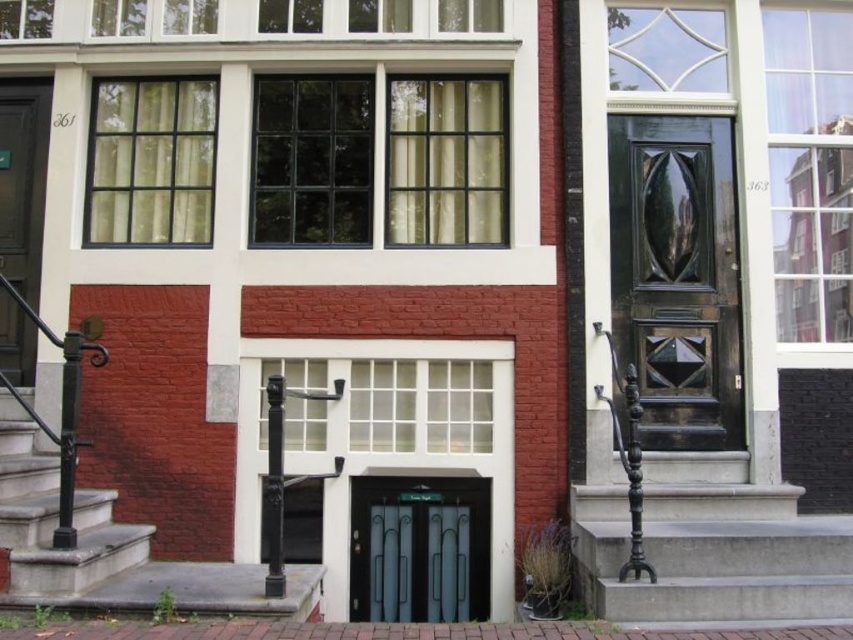
Can you confirm if black metal/staircase at lower right is smaller than matte black door at left?

No.

Does black metal/staircase at lower right appear on the right side of matte black door at left?

Yes, black metal/staircase at lower right is to the right of matte black door at left.

Find the location of a particular element. The height and width of the screenshot is (640, 853). black metal/staircase at lower right is located at coordinates click(x=711, y=548).

Is glossy wood door at right to the right of metallic gray door at center from the viewer's perspective?

Indeed, glossy wood door at right is positioned on the right side of metallic gray door at center.

Is point (676, 257) positioned behind point (363, 506)?

Yes, it is behind point (363, 506).

Where is `glossy wood door at right`? glossy wood door at right is located at coordinates (677, 276).

Between point (399, 522) and point (26, 196), which one is positioned in front?

Point (399, 522) is more forward.

I want to click on metallic gray door at center, so click(419, 548).

Is point (473, 540) in front of point (16, 172)?

Yes, point (473, 540) is in front of point (16, 172).

Where is `metallic gray door at center`? The width and height of the screenshot is (853, 640). metallic gray door at center is located at coordinates (419, 548).